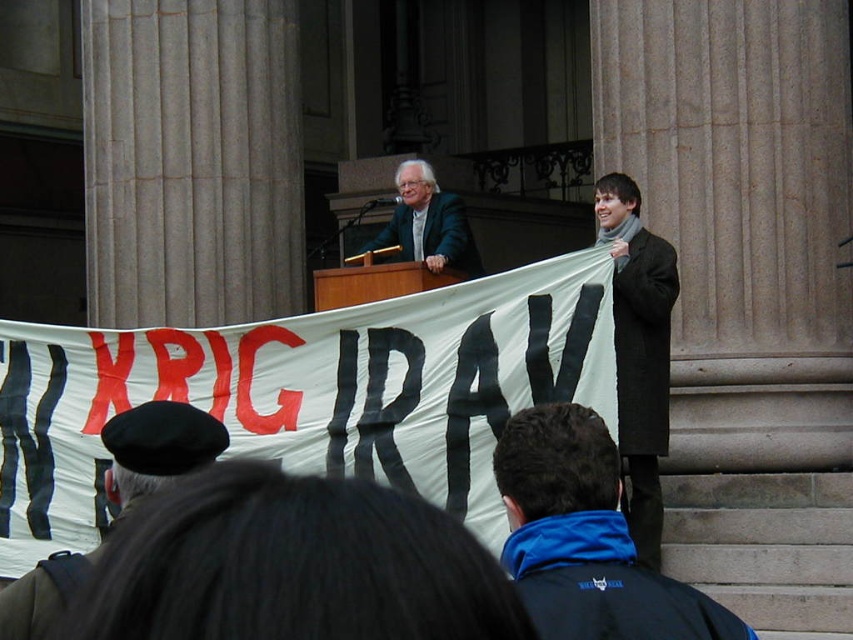
Question: Does black beret at center have a smaller size compared to matte black suit at center?

Choices:
 (A) no
 (B) yes

Answer: (B)

Question: Which object is positioned farthest from the blue fleece jacket at lower center?

Choices:
 (A) black beret at center
 (B) dark gray wool coat at right

Answer: (B)

Question: Which of the following is the closest to the observer?

Choices:
 (A) (178, 403)
 (B) (408, 252)
 (C) (657, 397)
 (D) (523, 428)

Answer: (D)

Question: Can you confirm if blue fleece jacket at lower center is positioned above black beret at center?

Choices:
 (A) yes
 (B) no

Answer: (A)

Question: Where is dark gray wool coat at right located in relation to matte black suit at center in the image?

Choices:
 (A) above
 (B) below

Answer: (B)

Question: Which of the following is the farthest from the observer?

Choices:
 (A) dark gray wool coat at right
 (B) black beret at center
 (C) matte black suit at center

Answer: (C)